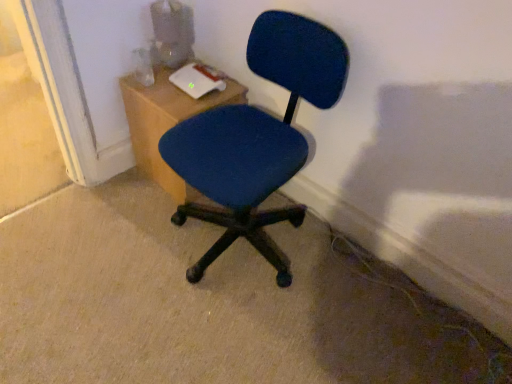
You are a GUI agent. You are given a task and a screenshot of the screen. Output one action in this format:
    pyautogui.click(x=<x>, y=<y>)
    Task: Click on the vacant area situated to the left side of wooden table at upper left
    
    Given the screenshot: What is the action you would take?
    pyautogui.click(x=112, y=187)